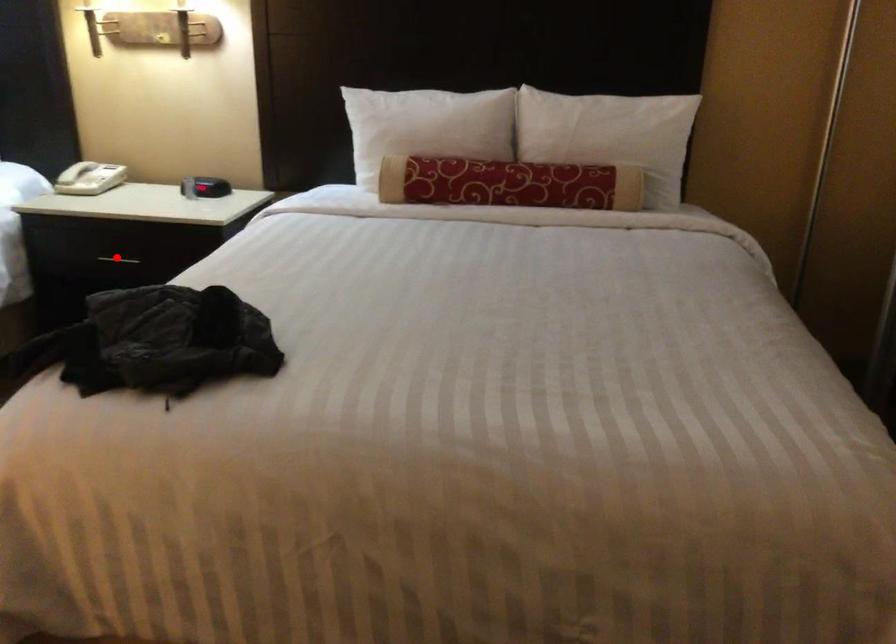
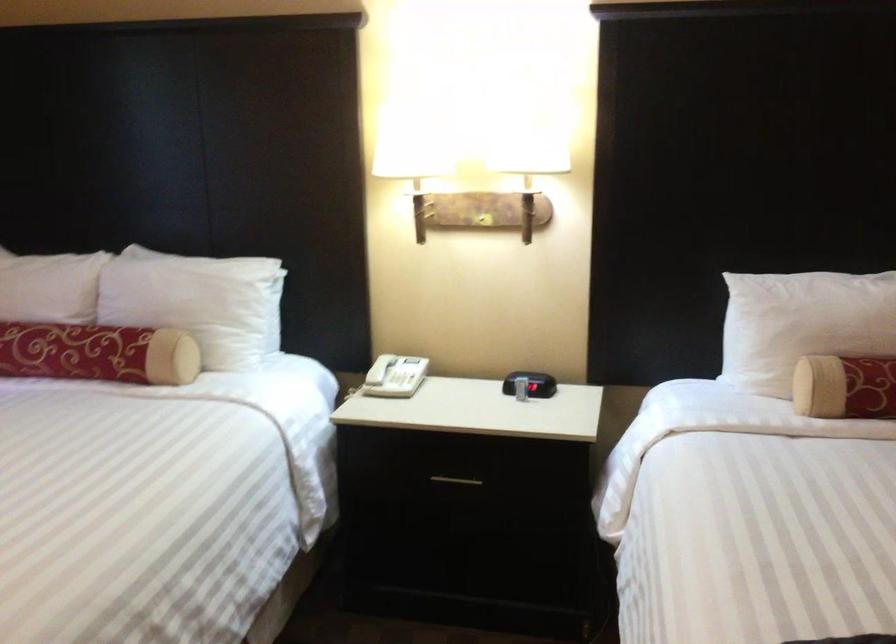
Question: A red point is marked in image1. In image2, is the corresponding 3D point closer to the camera or farther? Reply with the corresponding letter.

Choices:
 (A) The corresponding 3D point is closer.
 (B) The corresponding 3D point is farther.

Answer: (A)